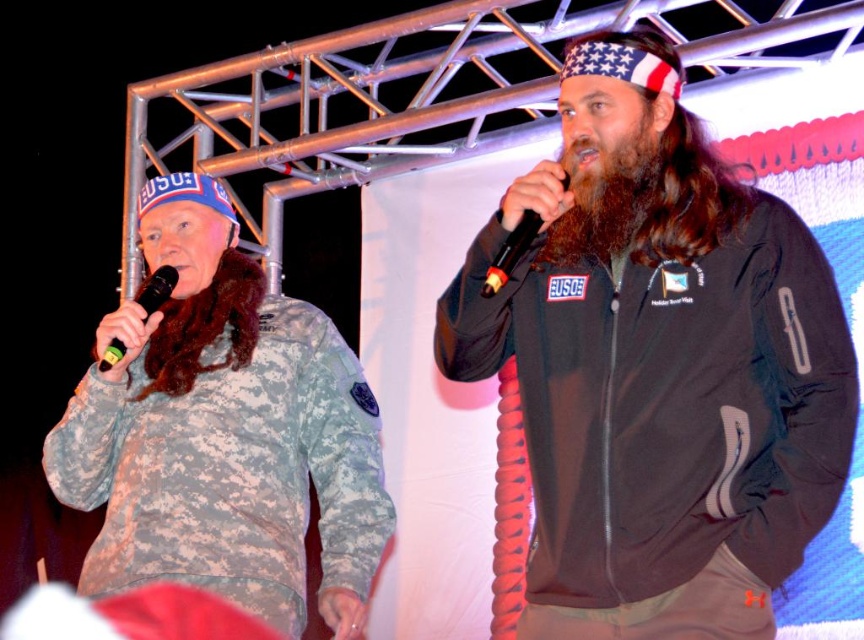
You are a stagehand setting up a backdrop for a performance. The backdrop has a narrow slit that is exactly the width of the black plastic microphone at center. If you try to slide the black matte jacket at center through this slit, will it fit?

The black matte jacket at center might be wider than black plastic microphone at center, so it might not fit through the slit designed for the microphone.

You are a photographer at the event and want to ensure that the black matte jacket at center is visible in your photo. Given that the camera is positioned at the point marked by the coordinate point at center, which is point (658,365), will the black matte jacket at center be in the frame?

Yes, the point (658,365) marks the black matte jacket at center, so positioning the camera at that coordinate will directly center the black matte jacket at center in the frame.

You are a stagehand responsible for setting up the equipment. You notice the black matte jacket at center and the black matte microphone at left on stage. Which object should you prioritize moving first if you need to clear the stage quickly, considering their sizes?

The black matte jacket at center should be prioritized because it has a larger size compared to the black matte microphone at left, making it more urgent to move first.